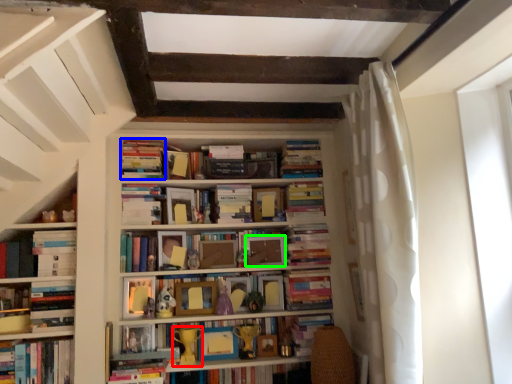
Question: Estimate the real-world distances between objects in this image. Which object is farther from toy (highlighted by a red box), book (highlighted by a blue box) or paperback book (highlighted by a green box)?

Choices:
 (A) book
 (B) paperback book

Answer: (A)